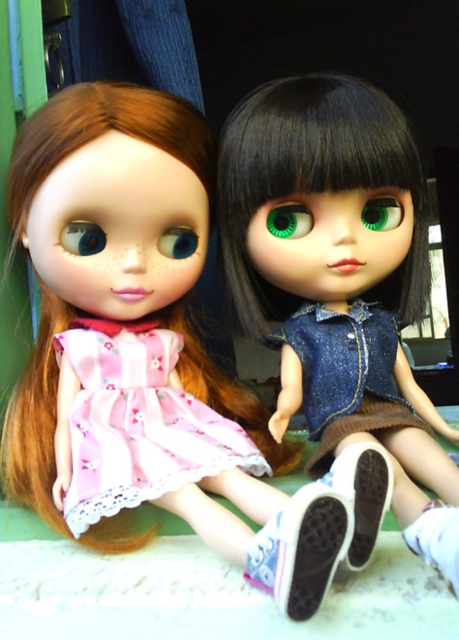
Question: Which of these objects is positioned farthest from the pink fabric dress at center?

Choices:
 (A) denim fabric dress at center
 (B) black canvas shoe at lower center
 (C) white canvas shoe at lower center

Answer: (B)

Question: Is white canvas shoe at lower center above black canvas shoe at lower center?

Choices:
 (A) no
 (B) yes

Answer: (A)

Question: Which point appears farthest from the camera in this image?

Choices:
 (A) (335, 564)
 (B) (323, 451)
 (C) (386, 458)

Answer: (B)

Question: Based on their relative distances, which object is farther from the pink fabric dress at center?

Choices:
 (A) denim jacket at center
 (B) white canvas shoe at lower center
 (C) denim fabric dress at center
 (D) pink lace dress at center

Answer: (B)

Question: Can you confirm if denim fabric dress at center is thinner than white canvas shoe at lower center?

Choices:
 (A) yes
 (B) no

Answer: (B)

Question: Can you confirm if denim jacket at center is positioned below white canvas shoe at lower center?

Choices:
 (A) yes
 (B) no

Answer: (B)